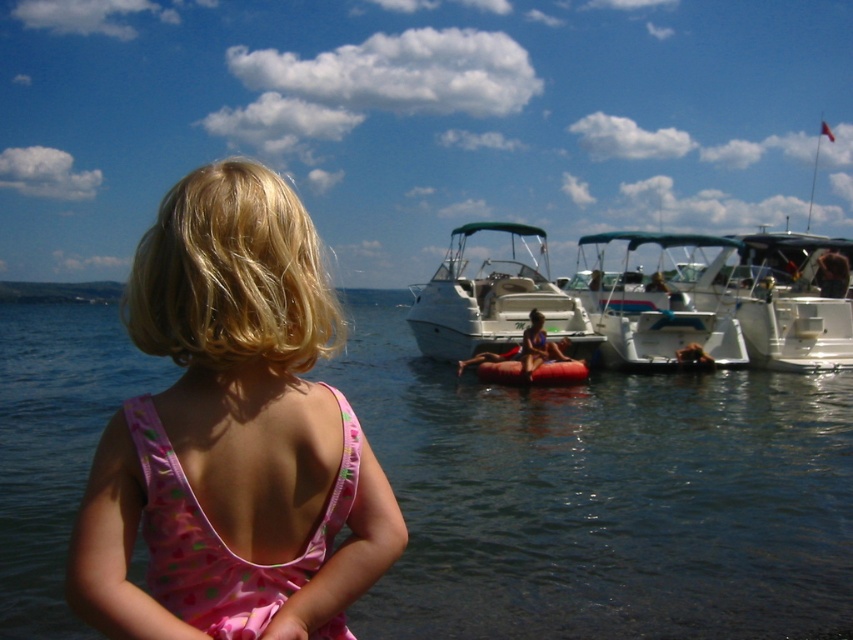
Question: Which of the following is the farthest from the observer?

Choices:
 (A) (183, 525)
 (B) (677, 250)
 (C) (558, 289)

Answer: (B)

Question: Based on their relative distances, which object is farther from the white glossy boat at center?

Choices:
 (A) transparent water at center
 (B) matte pink swimsuit at center

Answer: (A)

Question: Where is pink fabric dress at center located in relation to matte pink swimsuit at center in the image?

Choices:
 (A) right
 (B) left

Answer: (B)

Question: Which of the following is the farthest from the observer?

Choices:
 (A) transparent water at center
 (B) matte pink swimsuit at center
 (C) pink fabric dress at lower left

Answer: (B)

Question: Does transparent water at center lie behind pink fabric dress at lower left?

Choices:
 (A) yes
 (B) no

Answer: (A)

Question: Can you confirm if transparent water at center is positioned to the right of matte pink swimsuit at center?

Choices:
 (A) no
 (B) yes

Answer: (A)